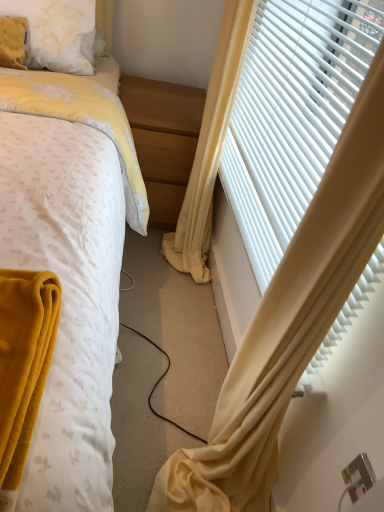
Question: Should I look upward or downward to see yellow fabric curtain at right, marked as the 1th curtain in a right-to-left arrangement?

Choices:
 (A) down
 (B) up

Answer: (B)

Question: Does fluffy white pillow at upper left contain yellow fabric curtain at right, marked as the 1th curtain in a right-to-left arrangement?

Choices:
 (A) yes
 (B) no

Answer: (B)

Question: Is fluffy white pillow at upper left taller than yellow fabric curtain at right, the 2th curtain positioned from the left?

Choices:
 (A) no
 (B) yes

Answer: (A)

Question: Can you confirm if fluffy white pillow at upper left is smaller than yellow fabric curtain at right, marked as the 1th curtain in a right-to-left arrangement?

Choices:
 (A) no
 (B) yes

Answer: (B)

Question: From the image's perspective, is fluffy white pillow at upper left under yellow fabric curtain at right, the 2th curtain positioned from the left?

Choices:
 (A) no
 (B) yes

Answer: (A)

Question: Is fluffy white pillow at upper left looking in the opposite direction of yellow fabric curtain at right, the 2th curtain positioned from the left?

Choices:
 (A) yes
 (B) no

Answer: (B)

Question: Can you confirm if fluffy white pillow at upper left is positioned to the left of yellow fabric curtain at right, marked as the 1th curtain in a right-to-left arrangement?

Choices:
 (A) no
 (B) yes

Answer: (B)

Question: From a real-world perspective, is yellow fabric curtain at right, the 1th curtain positioned from the left, located beneath white plastic blinds at right?

Choices:
 (A) no
 (B) yes

Answer: (B)

Question: Is yellow fabric curtain at right, which is the second curtain from right to left, shorter than white plastic blinds at right?

Choices:
 (A) yes
 (B) no

Answer: (B)

Question: Is yellow fabric curtain at right, the 1th curtain positioned from the left, located outside white plastic blinds at right?

Choices:
 (A) yes
 (B) no

Answer: (A)

Question: From the image's perspective, does yellow fabric curtain at right, which is the second curtain from right to left, appear lower than white plastic blinds at right?

Choices:
 (A) no
 (B) yes

Answer: (B)

Question: Is yellow fabric curtain at right, the 1th curtain positioned from the left, not near white plastic blinds at right?

Choices:
 (A) no
 (B) yes

Answer: (A)

Question: Does yellow fabric curtain at right, the 1th curtain positioned from the left, have a lesser width compared to white plastic blinds at right?

Choices:
 (A) no
 (B) yes

Answer: (A)

Question: Is yellow fabric curtain at right, the 2th curtain positioned from the left, thinner than silver metallic electric outlet at lower right?

Choices:
 (A) yes
 (B) no

Answer: (B)